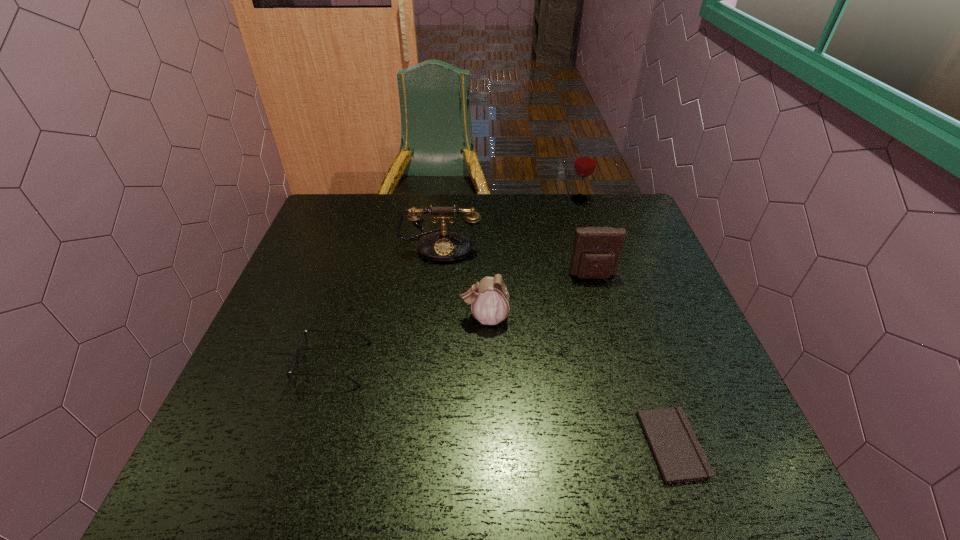
Image resolution: width=960 pixels, height=540 pixels. I want to click on blank region between the fifth tallest object and the glass, so click(x=456, y=282).

Find the location of a particular element. empty location between the leftmost object and the farthest object is located at coordinates (456, 282).

Select which object appears as the third closest to the tallest object. Please provide its 2D coordinates. Your answer should be formatted as a tuple, i.e. [(x, y)], where the tuple contains the x and y coordinates of a point satisfying the conditions above.

[(489, 298)]

Choose which object is the nearest neighbor to the fifth nearest object. Please provide its 2D coordinates. Your answer should be formatted as a tuple, i.e. [(x, y)], where the tuple contains the x and y coordinates of a point satisfying the conditions above.

[(489, 298)]

Locate an element on the screen. free spot that satisfies the following two spatial constraints: 1. with an open flap on the farther pouch; 2. on the front-facing side of the fourth farthest object is located at coordinates (604, 318).

This screenshot has width=960, height=540. What are the coordinates of `free spot that satisfies the following two spatial constraints: 1. on the front-facing side of the nearest object; 2. on the right side of the left pouch` in the screenshot? It's located at (486, 445).

Where is `free point that satisfies the following two spatial constraints: 1. with an open flap on the right pouch; 2. with the lenses facing outward on the second nearest object`? free point that satisfies the following two spatial constraints: 1. with an open flap on the right pouch; 2. with the lenses facing outward on the second nearest object is located at coordinates (617, 364).

Locate an element on the screen. vacant space that satisfies the following two spatial constraints: 1. with an open flap on the checkbook; 2. on the right side of the right pouch is located at coordinates [x=640, y=445].